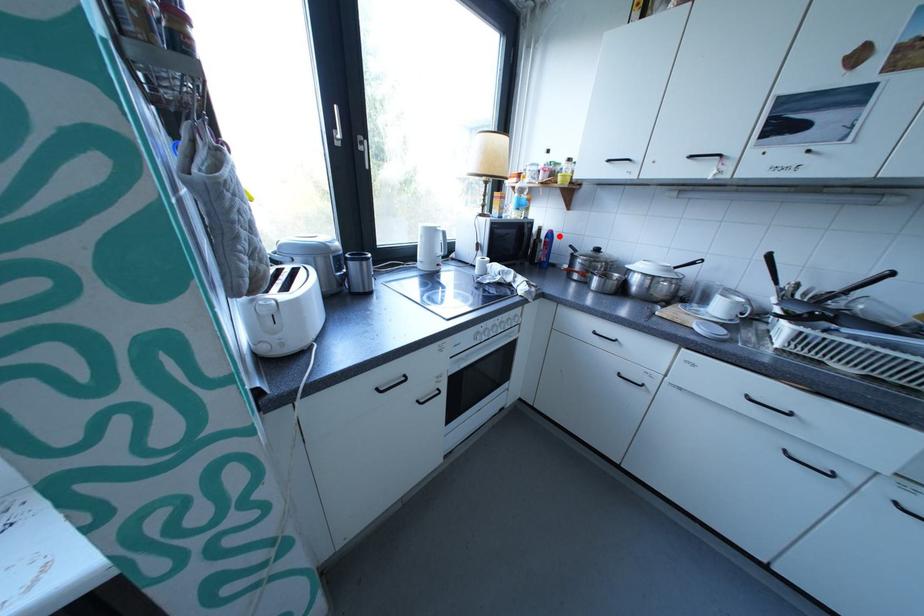
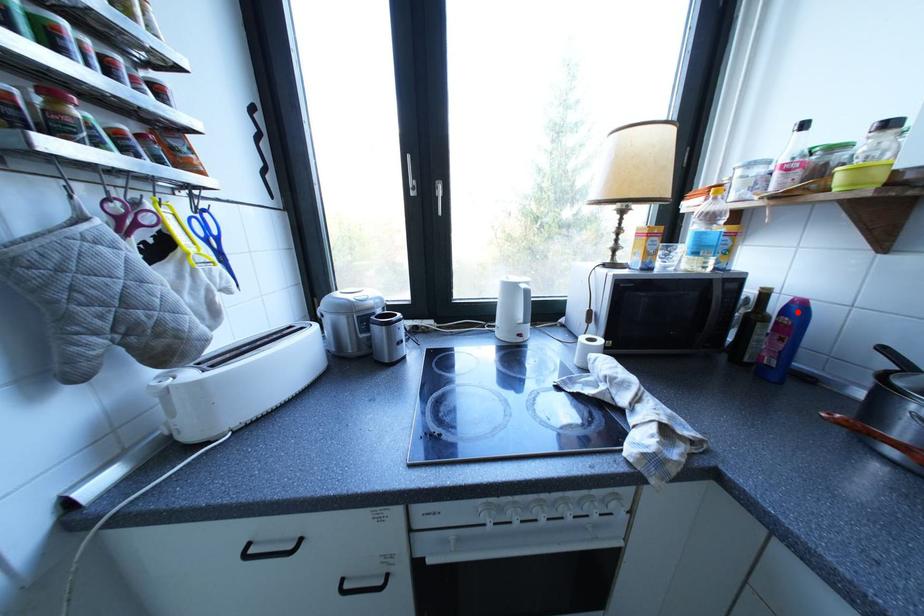
I am providing you with two images of the same scene from different viewpoints. A red point is marked on the first image and another point is marked on the second image. Does the point marked in image1 correspond to the same location as the one in image2?

Yes